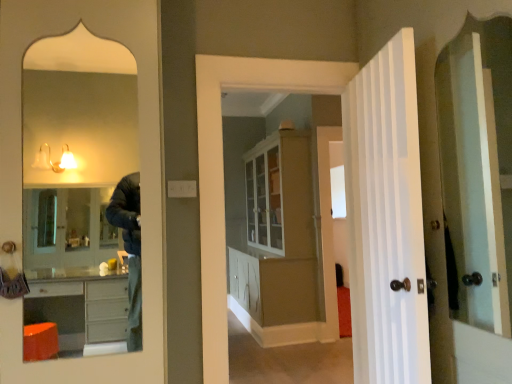
You are a GUI agent. You are given a task and a screenshot of the screen. Output one action in this format:
    pyautogui.click(x=<x>, y=<y>)
    Task: Click on the white glossy cabinet at center
    The width and height of the screenshot is (512, 384).
    Given the screenshot: What is the action you would take?
    pyautogui.click(x=280, y=231)

The image size is (512, 384). What do you see at coordinates (280, 231) in the screenshot? I see `white glossy cabinet at center` at bounding box center [280, 231].

What is the approximate height of white glossy cabinet at center?

white glossy cabinet at center is 6.90 feet tall.

The width and height of the screenshot is (512, 384). I want to click on white painted wood door at right, so click(x=386, y=218).

This screenshot has height=384, width=512. What do you see at coordinates (386, 218) in the screenshot?
I see `white painted wood door at right` at bounding box center [386, 218].

You are a GUI agent. You are given a task and a screenshot of the screen. Output one action in this format:
    pyautogui.click(x=<x>, y=<y>)
    Task: Click on the white glossy cabinet at center
    
    Given the screenshot: What is the action you would take?
    pyautogui.click(x=280, y=231)

Looking at this image, which is more to the left, white painted wood door at right or white glossy cabinet at center?

white glossy cabinet at center.

Between white painted wood door at right and white glossy cabinet at center, which one is positioned in front?

white painted wood door at right is closer to the camera.

Does point (401, 79) lie behind point (267, 208)?

No.

From the image's perspective, which one is positioned higher, white painted wood door at right or white glossy cabinet at center?

white painted wood door at right, from the image's perspective.

From a real-world perspective, is white painted wood door at right positioned above or below white glossy cabinet at center?

Clearly, from a real-world perspective, white painted wood door at right is above white glossy cabinet at center.

Which object is wider, white painted wood door at right or white glossy cabinet at center?

Wider between the two is white glossy cabinet at center.

Consider the image. Can you confirm if white painted wood door at right is taller than white glossy cabinet at center?

No, white painted wood door at right is not taller than white glossy cabinet at center.

Who is smaller, white painted wood door at right or white glossy cabinet at center?

Smaller between the two is white painted wood door at right.

Would you say white painted wood door at right contains white glossy cabinet at center?

No, white painted wood door at right does not contain white glossy cabinet at center.

Is white painted wood door at right in contact with white glossy cabinet at center?

No, white painted wood door at right is not touching white glossy cabinet at center.

Is white painted wood door at right aimed at white glossy cabinet at center?

No.

How much distance is there between white painted wood door at right and white glossy cabinet at center?

white painted wood door at right is 7.02 feet from white glossy cabinet at center.

At what (x,y) coordinates should I click in order to perform the action: click on door located in front of the white glossy cabinet at center. Please return your answer as a coordinate pair (x, y). The height and width of the screenshot is (384, 512). Looking at the image, I should click on (386, 218).

Is white glossy cabinet at center to the left or to the right of white painted wood door at right in the image?

white glossy cabinet at center is to the left of white painted wood door at right.

Based on the photo, relative to white painted wood door at right, is white glossy cabinet at center in front or behind?

Visually, white glossy cabinet at center is located behind white painted wood door at right.

Does point (260, 288) come in front of point (410, 51)?

No, it is behind (410, 51).

Looking at this image, from the image's perspective, is white glossy cabinet at center located above or below white painted wood door at right?

white glossy cabinet at center is situated lower than white painted wood door at right in the image.

From a real-world perspective, is white glossy cabinet at center beneath white painted wood door at right?

Yes, from a real-world perspective, white glossy cabinet at center is below white painted wood door at right.

Does white glossy cabinet at center have a greater width compared to white painted wood door at right?

Yes.

Considering the sizes of objects white glossy cabinet at center and white painted wood door at right in the image provided, who is shorter, white glossy cabinet at center or white painted wood door at right?

white painted wood door at right is shorter.

Who is smaller, white glossy cabinet at center or white painted wood door at right?

white painted wood door at right.

Is white glossy cabinet at center not within white painted wood door at right?

Yes, white glossy cabinet at center is outside of white painted wood door at right.

Is white glossy cabinet at center next to white painted wood door at right and touching it?

No, white glossy cabinet at center is not next to white painted wood door at right.

Is white glossy cabinet at center facing away from white painted wood door at right?

white glossy cabinet at center does not have its back to white painted wood door at right.

How many degrees apart are the facing directions of white glossy cabinet at center and white painted wood door at right?

white glossy cabinet at center and white painted wood door at right are facing 9.43 degrees away from each other.

Locate an element on the screen. dresser behind the white painted wood door at right is located at coordinates (280, 231).

Where is `door that appears above the white glossy cabinet at center (from the image's perspective)`? door that appears above the white glossy cabinet at center (from the image's perspective) is located at coordinates (386, 218).

This screenshot has width=512, height=384. In order to click on door located on the right of white glossy cabinet at center in this screenshot , I will do tap(386, 218).